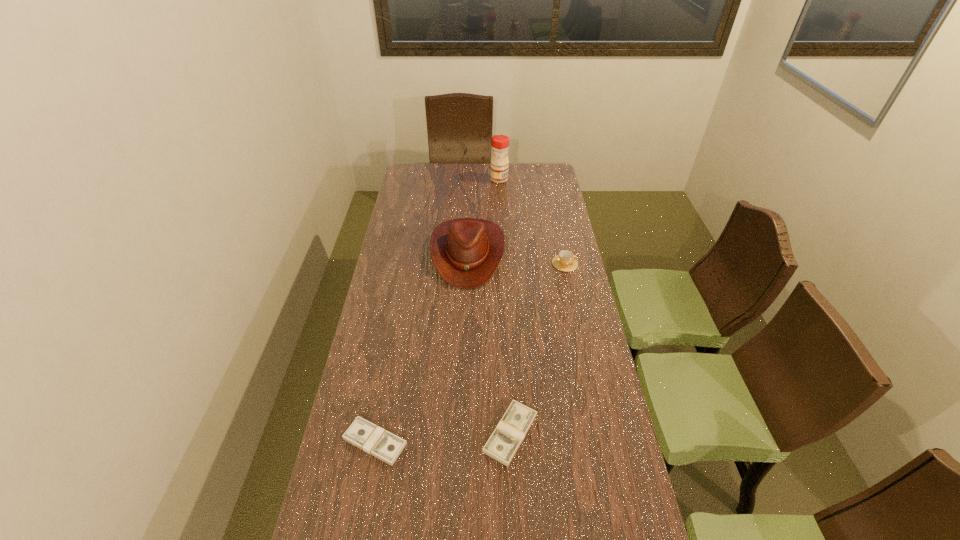
Image resolution: width=960 pixels, height=540 pixels. I want to click on the tallest object, so click(x=500, y=143).

Where is `condiment`? This screenshot has height=540, width=960. condiment is located at coordinates (500, 143).

Where is `the second tallest object`? This screenshot has width=960, height=540. the second tallest object is located at coordinates (466, 252).

Where is `the third tallest object`? The image size is (960, 540). the third tallest object is located at coordinates (565, 261).

Where is `the rightmost object`? the rightmost object is located at coordinates (565, 261).

What are the coordinates of `the right dollar` in the screenshot? It's located at (502, 445).

Image resolution: width=960 pixels, height=540 pixels. Identify the location of the left dollar. (363, 434).

Where is `vacant space situated on the front of the condiment`? This screenshot has height=540, width=960. vacant space situated on the front of the condiment is located at coordinates (500, 189).

I want to click on free space located on the front-facing side of the fourth shortest object, so click(x=465, y=353).

This screenshot has width=960, height=540. I want to click on vacant space positioned 0.220m on the left of the right dollar, so click(405, 433).